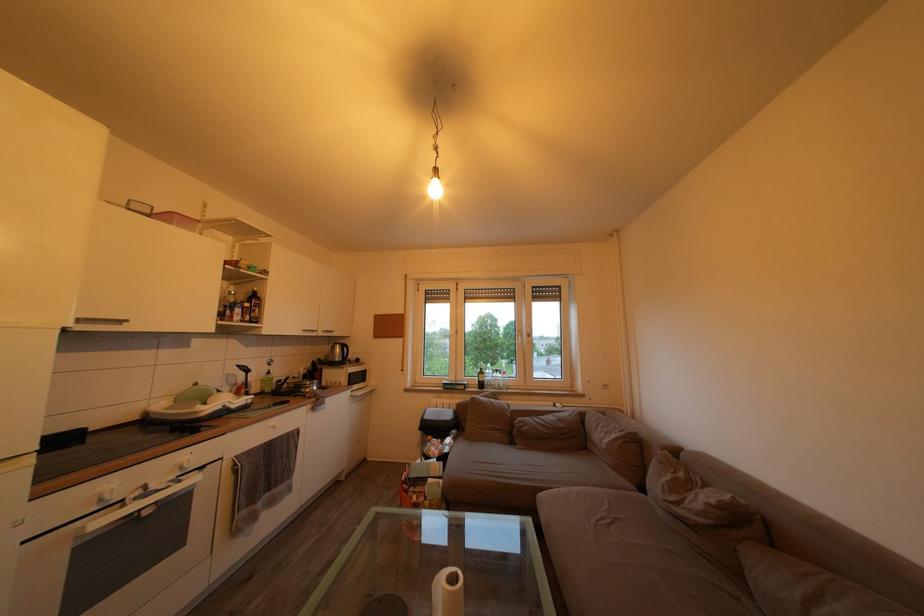
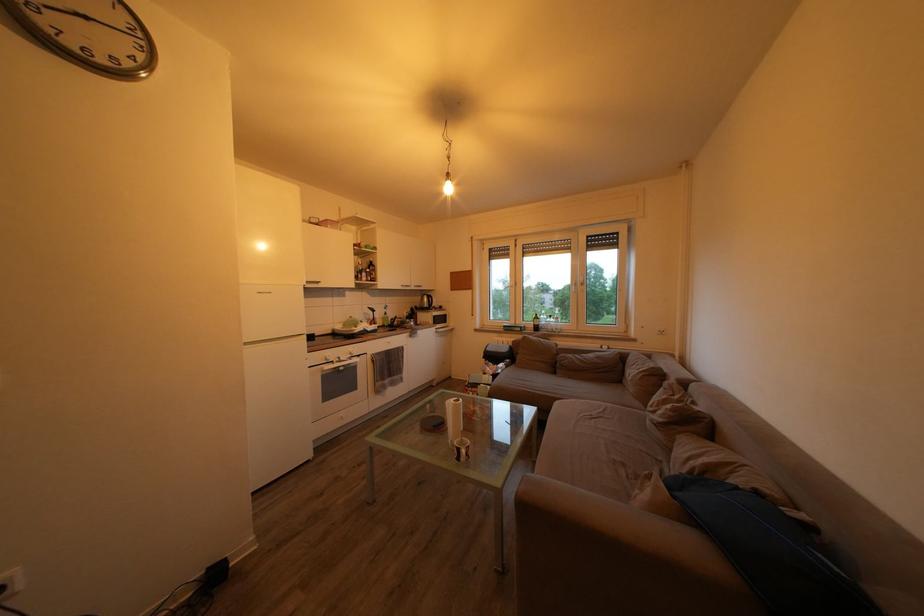
Locate, in the second image, the point that corresponds to (310,376) in the first image.

(412, 318)